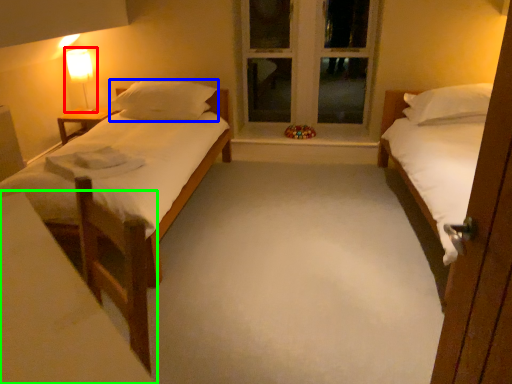
Question: Estimate the real-world distances between objects in this image. Which object is closer to bedside lamp (highlighted by a red box), pillow (highlighted by a blue box) or vanity (highlighted by a green box)?

Choices:
 (A) pillow
 (B) vanity

Answer: (A)